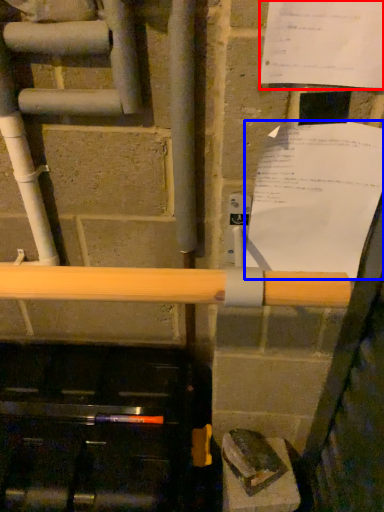
Question: Among these objects, which one is nearest to the camera, paper (highlighted by a red box) or paper (highlighted by a blue box)?

Choices:
 (A) paper
 (B) paper

Answer: (A)